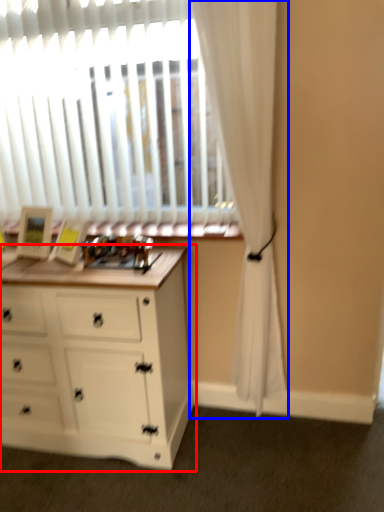
Question: Which object appears farthest to the camera in this image, chest of drawers (highlighted by a red box) or curtain (highlighted by a blue box)?

Choices:
 (A) chest of drawers
 (B) curtain

Answer: (A)